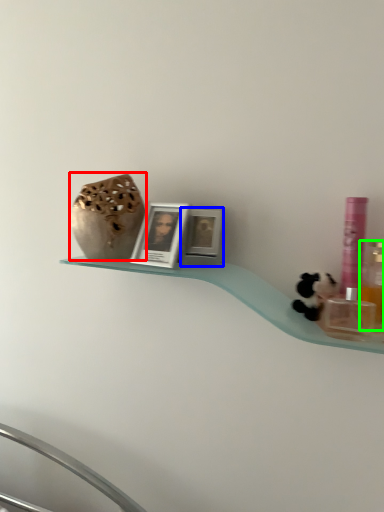
Question: Considering the real-world distances, which object is closest to vase (highlighted by a red box)? picture frame (highlighted by a blue box) or mouthwash (highlighted by a green box).

Choices:
 (A) picture frame
 (B) mouthwash

Answer: (A)